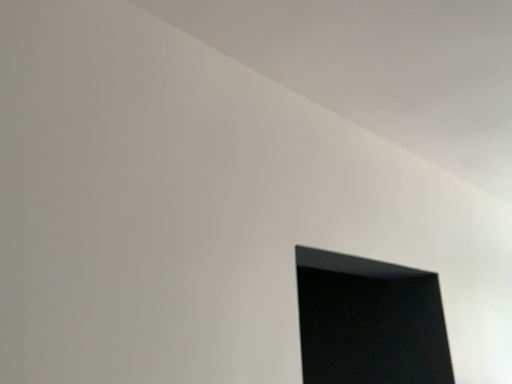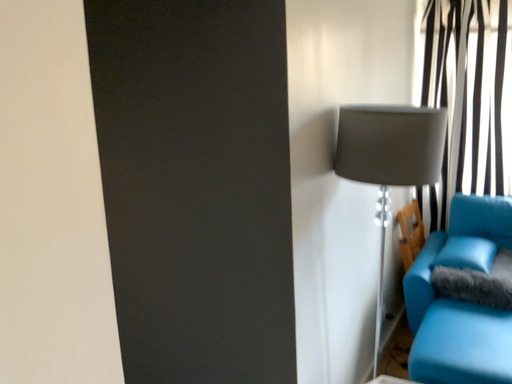
Question: Which way did the camera rotate in the video?

Choices:
 (A) rotated downward
 (B) rotated upward

Answer: (A)